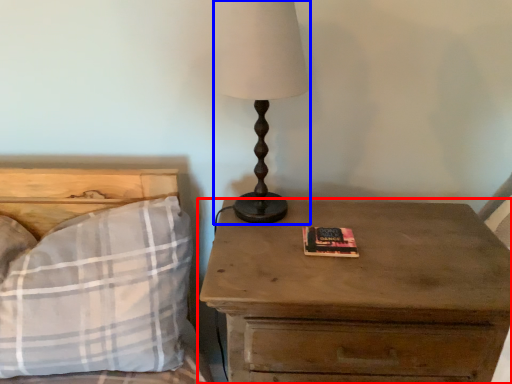
Question: Which point is closer to the camera, nightstand (highlighted by a red box) or table lamp (highlighted by a blue box)?

Choices:
 (A) nightstand
 (B) table lamp

Answer: (A)